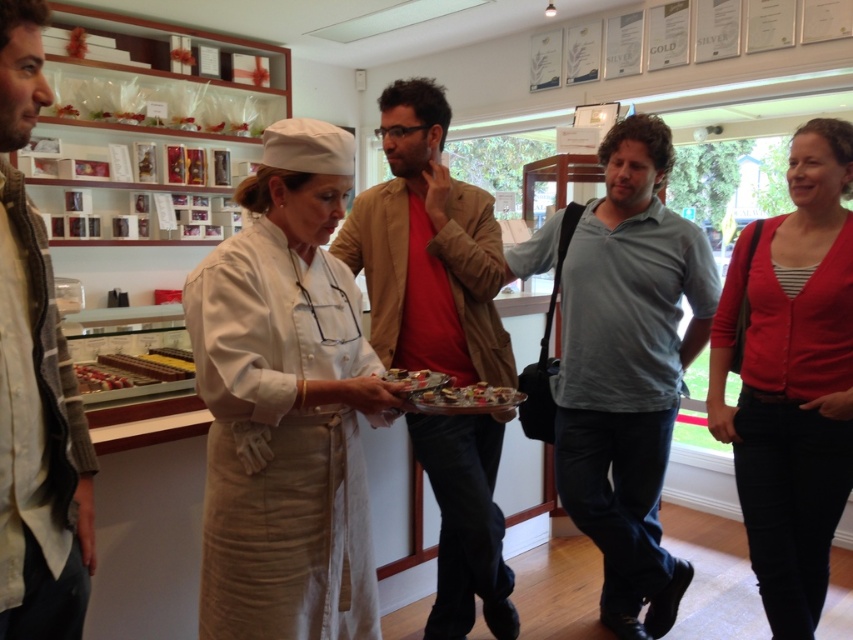
You are a customer standing in the bakery and want to buy the white linen chef hat at center. Can you reach it without moving closer?

The white linen chef hat at center is 1.28 meters away from viewer, so you can reach it without moving closer if your arm can extend that far.

You are a customer in this bakery and you want to choose between the matte beige blazer at center and the chocolate matte at center. Which one is larger in size?

The matte beige blazer at center is bigger than the chocolate matte at center, so the matte beige blazer at center is larger in size.